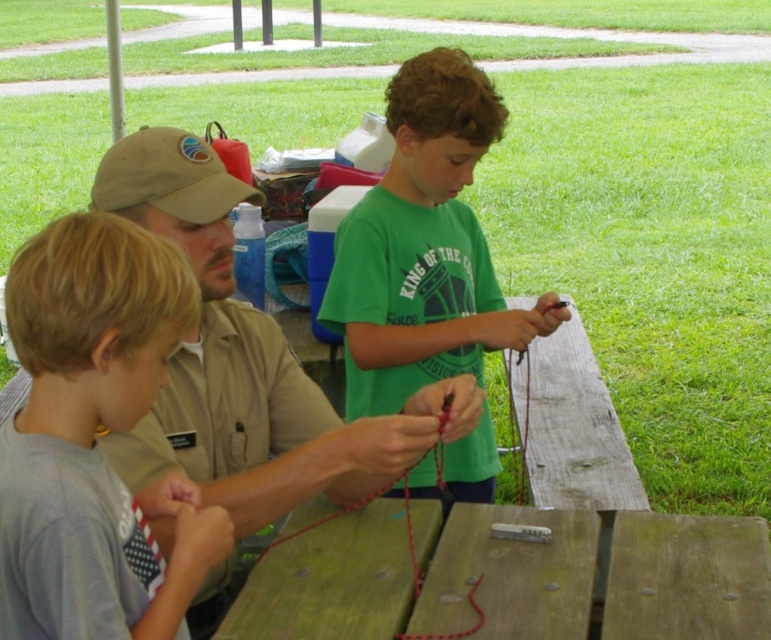
Question: Is wooden at center smaller than gray cotton shirt at left?

Choices:
 (A) yes
 (B) no

Answer: (B)

Question: Is gray cotton shirt at left closer to the viewer compared to khaki fabric shirt at center?

Choices:
 (A) no
 (B) yes

Answer: (B)

Question: Does khaki fabric shirt at center have a lesser width compared to green matte shirt at center?

Choices:
 (A) yes
 (B) no

Answer: (B)

Question: Among these objects, which one is nearest to the camera?

Choices:
 (A) gray cotton shirt at left
 (B) green matte shirt at center
 (C) wooden at center
 (D) khaki fabric shirt at center

Answer: (A)

Question: Which point is farther from the camera taking this photo?

Choices:
 (A) (39, 509)
 (B) (651, 598)
 (C) (163, 179)

Answer: (C)

Question: Which point appears closest to the camera in this image?

Choices:
 (A) (665, 525)
 (B) (466, 225)
 (C) (105, 392)

Answer: (C)